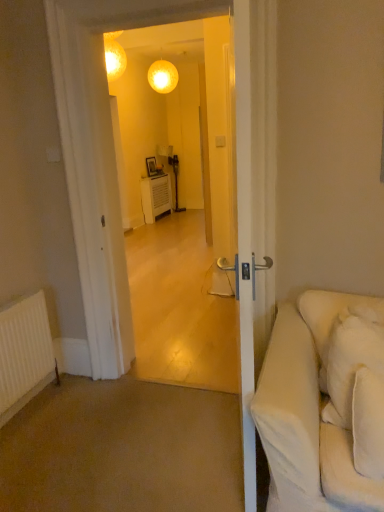
Locate an element on the screen. free region under white matte radiator at lower left (from a real-world perspective) is located at coordinates (34, 410).